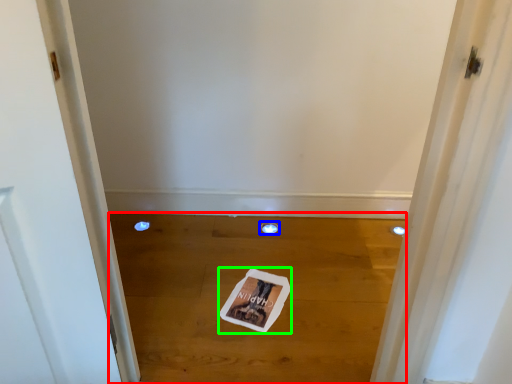
Question: Considering the real-world distances, which object is closest to plain (highlighted by a red box)? hole (highlighted by a blue box) or magazine (highlighted by a green box).

Choices:
 (A) hole
 (B) magazine

Answer: (B)